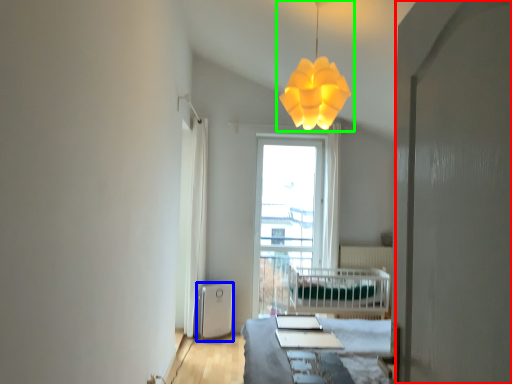
Question: Estimate the real-world distances between objects in this image. Which object is closer to screen door (highlighted by a red box), water heater (highlighted by a blue box) or lamp (highlighted by a green box)?

Choices:
 (A) water heater
 (B) lamp

Answer: (B)